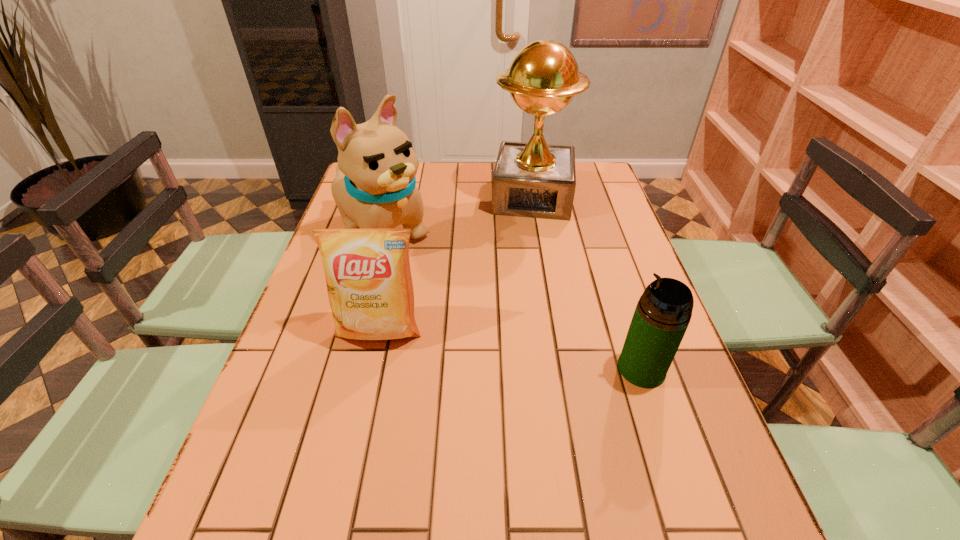
Identify the location of empty location between the second tallest object and the award. Image resolution: width=960 pixels, height=540 pixels. (457, 215).

The height and width of the screenshot is (540, 960). I want to click on free space between the award and the puppy, so click(x=457, y=215).

I want to click on free spot between the crisp (potato chip) and the award, so click(456, 264).

In order to click on the closest object to the award in this screenshot , I will do `click(375, 187)`.

Identify the location of object that stands as the closest to the thermos bottle. The height and width of the screenshot is (540, 960). point(368,277).

I want to click on free region that satisfies the following two spatial constraints: 1. on the back side of the puppy; 2. on the left side of the award, so click(392, 197).

The image size is (960, 540). I want to click on vacant space that satisfies the following two spatial constraints: 1. on the front side of the thermos bottle; 2. from the spout of the award, so click(x=561, y=369).

Where is `blank area in the image that satisfies the following two spatial constraints: 1. on the front side of the thermos bottle; 2. from the spout of the second tallest object`? blank area in the image that satisfies the following two spatial constraints: 1. on the front side of the thermos bottle; 2. from the spout of the second tallest object is located at coordinates click(344, 369).

Where is `free space that satisfies the following two spatial constraints: 1. on the front side of the puppy; 2. from the spout of the thermos bottle`? The width and height of the screenshot is (960, 540). free space that satisfies the following two spatial constraints: 1. on the front side of the puppy; 2. from the spout of the thermos bottle is located at coordinates (344, 369).

Where is `free spot that satisfies the following two spatial constraints: 1. on the front-facing side of the crisp (potato chip); 2. from the spout of the thermos bottle`? The height and width of the screenshot is (540, 960). free spot that satisfies the following two spatial constraints: 1. on the front-facing side of the crisp (potato chip); 2. from the spout of the thermos bottle is located at coordinates (371, 369).